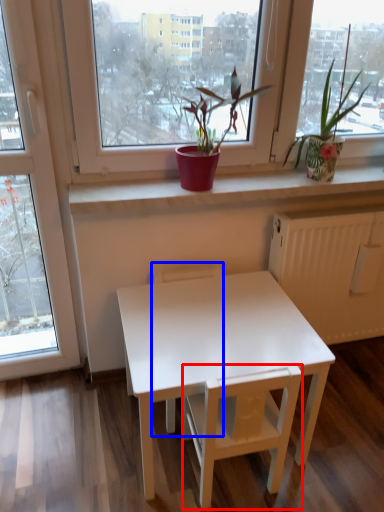
Question: Which point is further to the camera, armchair (highlighted by a red box) or armchair (highlighted by a blue box)?

Choices:
 (A) armchair
 (B) armchair

Answer: (B)